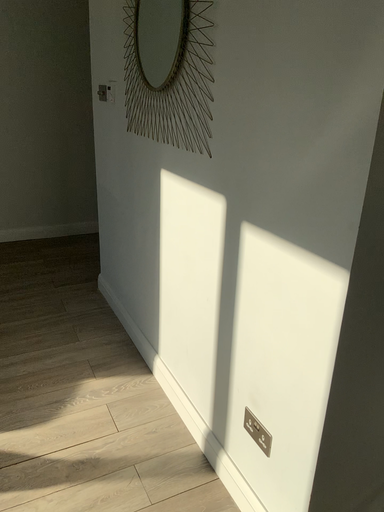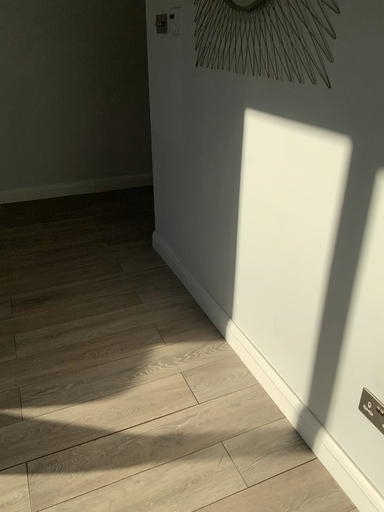
Question: How did the camera likely rotate when shooting the video?

Choices:
 (A) rotated upward
 (B) rotated downward

Answer: (B)